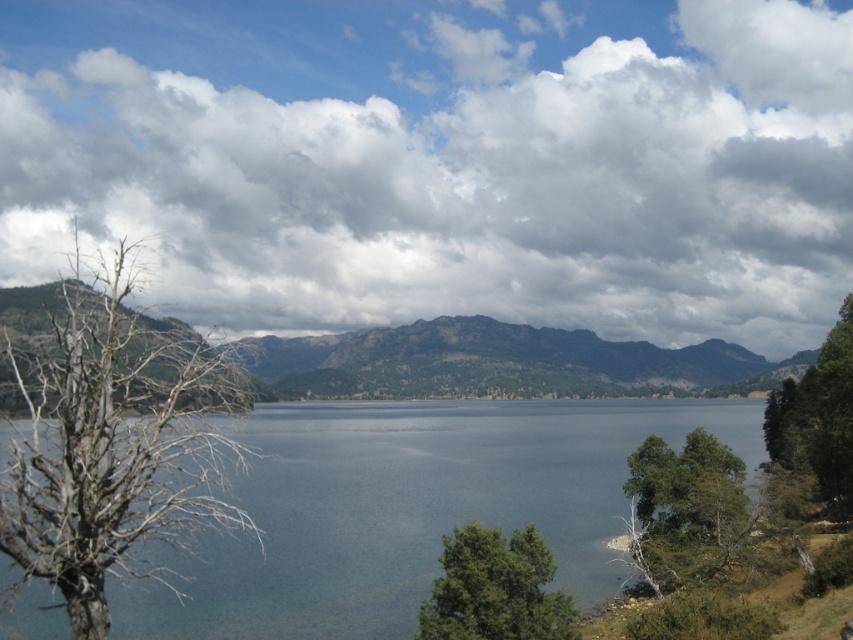
Is point (614, 369) closer to viewer compared to point (552, 628)?

No, (614, 369) is behind (552, 628).

Does rugged brown mountain at center appear over green leafy tree at lower center?

Incorrect, rugged brown mountain at center is not positioned above green leafy tree at lower center.

Measure the distance between point (635, 392) and camera.

Point (635, 392) and camera are 489.71 meters apart.

This screenshot has width=853, height=640. Find the location of `rugged brown mountain at center`. rugged brown mountain at center is located at coordinates [x=498, y=364].

Is bare wood tree at left taller than green leafy tree at lower right?

Yes.

The height and width of the screenshot is (640, 853). What do you see at coordinates (112, 444) in the screenshot?
I see `bare wood tree at left` at bounding box center [112, 444].

Does point (51, 513) come in front of point (636, 460)?

Yes, it is in front of point (636, 460).

The image size is (853, 640). I want to click on bare wood tree at left, so click(112, 444).

Between green leafy tree at lower center and green leafy tree at lower right, which one appears on the left side from the viewer's perspective?

From the viewer's perspective, green leafy tree at lower center appears more on the left side.

Is green leafy tree at lower center shorter than green leafy tree at lower right?

Indeed, green leafy tree at lower center has a lesser height compared to green leafy tree at lower right.

Does point (509, 604) come behind point (653, 481)?

No, it is not.

Find the location of a particular element. green leafy tree at lower center is located at coordinates (495, 589).